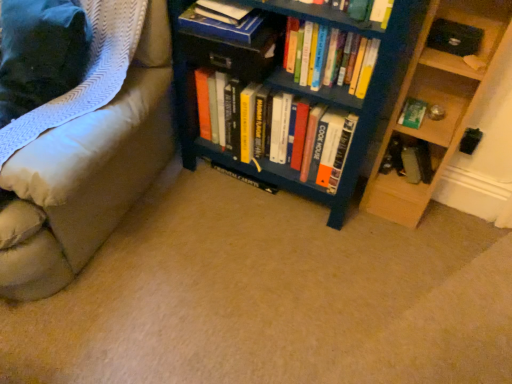
Find the location of a particular element. This screenshot has height=384, width=512. hardcover book at upper center, which appears as the 6th book when viewed from the right is located at coordinates (222, 11).

You are a GUI agent. You are given a task and a screenshot of the screen. Output one action in this format:
    pyautogui.click(x=<x>, y=<y>)
    Task: Click on the blue matte bookshelf at center
    Image resolution: width=512 pixels, height=384 pixels.
    Given the screenshot: What is the action you would take?
    pyautogui.click(x=272, y=298)

Where is `hardcover books at center, the fourth book from the left`? hardcover books at center, the fourth book from the left is located at coordinates (329, 57).

What do you see at coordinates (311, 141) in the screenshot? The width and height of the screenshot is (512, 384). I see `hardcover books at center, the 4th book viewed from the right` at bounding box center [311, 141].

I want to click on hardcover book at upper center, which is counted as the second book, starting from the left, so click(221, 27).

Find the location of a particular element. white textured blanket at left is located at coordinates (87, 73).

Based on the photo, is the depth of matte black book at lower right, which is the 1th book from right to left, greater than that of white textured blanket at left?

Yes.

From a real-world perspective, between matte black book at lower right, arranged as the sixth book when viewed from the left, and white textured blanket at left, who is vertically higher?

white textured blanket at left, from a real-world perspective.

From the white textured blanket at left, count 6th books backward and point to it. Please provide its 2D coordinates.

[(411, 159)]

Would you say matte black book at lower right, which is the 1th book from right to left, is to the left or to the right of white textured blanket at left in the picture?

From the image, it's evident that matte black book at lower right, which is the 1th book from right to left, is to the right of white textured blanket at left.

Which is correct: hardcover books at center, which is the third book in right-to-left order, is inside hardcover book at upper center, the fifth book when ordered from right to left, or outside of it?

hardcover books at center, which is the third book in right-to-left order, exists outside the volume of hardcover book at upper center, the fifth book when ordered from right to left.

Is hardcover books at center, the fourth book from the left, in front of or behind hardcover book at upper center, the fifth book when ordered from right to left, in the image?

Clearly, hardcover books at center, the fourth book from the left, is in front of hardcover book at upper center, the fifth book when ordered from right to left.

You are a GUI agent. You are given a task and a screenshot of the screen. Output one action in this format:
    pyautogui.click(x=<x>, y=<y>)
    Task: Click on the book that is the 2nd object located behind the hardcover books at center, which is the third book in right-to-left order
    
    Given the screenshot: What is the action you would take?
    pyautogui.click(x=221, y=27)

In the scene shown: How distant is hardcover books at center, which is the third book in right-to-left order, from hardcover book at upper center, which is counted as the second book, starting from the left?

hardcover books at center, which is the third book in right-to-left order, is 7.97 inches away from hardcover book at upper center, which is counted as the second book, starting from the left.

Based on the photo, which is more to the right, white textured blanket at left or hardcover book at upper center, the fifth book when ordered from right to left?

Positioned to the right is hardcover book at upper center, the fifth book when ordered from right to left.

Which is nearer, (135, 28) or (184, 19)?

Point (135, 28).

Would you say hardcover book at upper center, which is counted as the second book, starting from the left, is part of white textured blanket at left's contents?

No, hardcover book at upper center, which is counted as the second book, starting from the left, is not inside white textured blanket at left.

From a real-world perspective, between white textured blanket at left and hardcover book at upper center, which is counted as the second book, starting from the left, who is vertically higher?

hardcover book at upper center, which is counted as the second book, starting from the left, is physically above.

Between blue matte bookshelf at center and matte black book at lower right, arranged as the sixth book when viewed from the left, which one has larger width?

blue matte bookshelf at center.

Is blue matte bookshelf at center oriented away from matte black book at lower right, arranged as the sixth book when viewed from the left?

No, blue matte bookshelf at center's orientation is not away from matte black book at lower right, arranged as the sixth book when viewed from the left.

From a real-world perspective, is blue matte bookshelf at center positioned above or below matte black book at lower right, which is the 1th book from right to left?

blue matte bookshelf at center is situated lower than matte black book at lower right, which is the 1th book from right to left, in the real world.

Locate an element on the screen. plain in front of the matte black book at lower right, arranged as the sixth book when viewed from the left is located at coordinates (272, 298).

Can you confirm if white textured blanket at left is thinner than blue painted wood bookcase at center?

Indeed, white textured blanket at left has a lesser width compared to blue painted wood bookcase at center.

Identify the location of blanket on the left of blue painted wood bookcase at center. (87, 73).

Is white textured blanket at left in front of or behind blue painted wood bookcase at center in the image?

white textured blanket at left is positioned closer to the viewer than blue painted wood bookcase at center.

From the image's perspective, is white textured blanket at left above or below blue painted wood bookcase at center?

white textured blanket at left is above blue painted wood bookcase at center.

How many degrees apart are the facing directions of green matte book at right, the fifth book positioned from the left, and hardcover books at center, the 3th book positioned from the left?

0.421 degrees.

From a real-world perspective, is green matte book at right, which appears as the second book when viewed from the right, under hardcover books at center, the 3th book positioned from the left?

No, from a real-world perspective, green matte book at right, which appears as the second book when viewed from the right, is not under hardcover books at center, the 3th book positioned from the left.

Starting from the hardcover books at center, the 4th book viewed from the right, which book is the 1st one behind? Please provide its 2D coordinates.

[(412, 113)]

Choose the correct answer: Is green matte book at right, which appears as the second book when viewed from the right, inside hardcover books at center, the 3th book positioned from the left, or outside it?

The correct answer is: outside.

Consider the image. From a real-world perspective, between wooden at right and hardcover book at upper center, the fifth book when ordered from right to left, who is vertically higher?

hardcover book at upper center, the fifth book when ordered from right to left, from a real-world perspective.

At what (x,y) coordinates should I click in order to perform the action: click on the 4th book positioned above the wooden at right (from the image's perspective). Please return your answer as a coordinate pair (x, y). This screenshot has width=512, height=384. Looking at the image, I should click on (221, 27).

Is wooden at right next to hardcover book at upper center, the fifth book when ordered from right to left, and touching it?

No, wooden at right is not touching hardcover book at upper center, the fifth book when ordered from right to left.

Identify the location of blanket in front of the matte black book at lower right, which is the 1th book from right to left. (87, 73).

This screenshot has width=512, height=384. Identify the location of book that is the 2nd one when counting rightward from the hardcover book at upper center, which is counted as the second book, starting from the left. (329, 57).

From the image, which object appears to be nearer to white textured blanket at left, hardcover book at upper center, which appears as the 6th book when viewed from the right, or hardcover book at upper center, which is counted as the second book, starting from the left?

hardcover book at upper center, which is counted as the second book, starting from the left, is closer to white textured blanket at left.

Estimate the real-world distances between objects in this image. Which object is further from wooden at right, blue matte bookshelf at center or hardcover books at center, the 3th book positioned from the left?

Among the two, blue matte bookshelf at center is located further to wooden at right.

When comparing their distances from white textured blanket at left, does blue matte bookshelf at center or blue painted wood bookcase at center seem closer?

The object closer to white textured blanket at left is blue painted wood bookcase at center.

From the image, which object appears to be nearer to matte black book at lower right, arranged as the sixth book when viewed from the left, wooden at right or green matte book at right, the fifth book positioned from the left?

The object closer to matte black book at lower right, arranged as the sixth book when viewed from the left, is wooden at right.

In the scene shown: Considering their positions, is hardcover books at center, which is the third book in right-to-left order, positioned further to hardcover book at upper center, which is counted as the second book, starting from the left, than blue matte bookshelf at center?

The object further to hardcover book at upper center, which is counted as the second book, starting from the left, is blue matte bookshelf at center.

When comparing their distances from wooden at right, does green matte book at right, which appears as the second book when viewed from the right, or blue matte bookshelf at center seem further?

blue matte bookshelf at center is positioned further to the anchor wooden at right.

Based on their spatial positions, is hardcover books at center, the fourth book from the left, or hardcover book at upper center, which appears as the 6th book when viewed from the right, closer to white textured blanket at left?

hardcover book at upper center, which appears as the 6th book when viewed from the right.

Which object lies further to the anchor point hardcover book at upper center, which appears as the 6th book when viewed from the right, white textured blanket at left or blue painted wood bookcase at center?

white textured blanket at left is positioned further to the anchor hardcover book at upper center, which appears as the 6th book when viewed from the right.

The image size is (512, 384). In order to click on bookcase between blue matte bookshelf at center and green matte book at right, the fifth book positioned from the left, in the horizontal direction in this screenshot , I will do `click(287, 93)`.

I want to click on bookcase between hardcover book at upper center, which is counted as the second book, starting from the left, and wooden at right, so click(x=287, y=93).

This screenshot has width=512, height=384. In order to click on plain between white textured blanket at left and green matte book at right, which appears as the second book when viewed from the right in this screenshot , I will do `click(272, 298)`.

Where is `bookcase located between blue matte bookshelf at center and matte black book at lower right, arranged as the sixth book when viewed from the left, in the depth direction`? This screenshot has width=512, height=384. bookcase located between blue matte bookshelf at center and matte black book at lower right, arranged as the sixth book when viewed from the left, in the depth direction is located at coordinates (287, 93).